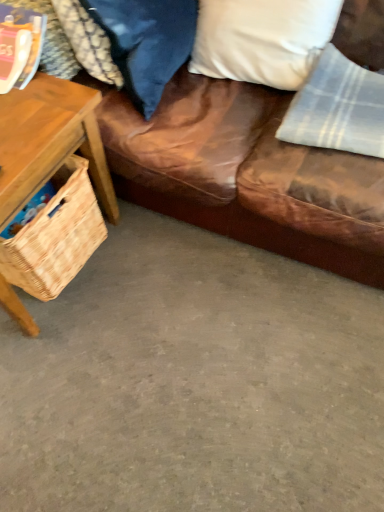
The height and width of the screenshot is (512, 384). Identify the location of free point to the right of woven straw picnic basket at left. (143, 266).